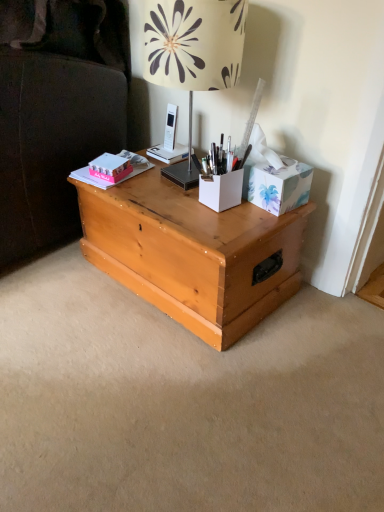
Question: From a real-world perspective, does beige floral lampshade at upper center stand above white matte pen holder at center, the first cardboard box in the left-to-right sequence?

Choices:
 (A) no
 (B) yes

Answer: (B)

Question: Does beige floral lampshade at upper center have a larger size compared to white matte pen holder at center, the first cardboard box in the left-to-right sequence?

Choices:
 (A) yes
 (B) no

Answer: (A)

Question: Does beige floral lampshade at upper center turn towards white matte pen holder at center, the first cardboard box in the left-to-right sequence?

Choices:
 (A) no
 (B) yes

Answer: (A)

Question: Is beige floral lampshade at upper center turned away from white matte pen holder at center, marked as the 2th cardboard box in a right-to-left arrangement?

Choices:
 (A) yes
 (B) no

Answer: (B)

Question: Is white matte pen holder at center, marked as the 2th cardboard box in a right-to-left arrangement, surrounded by beige floral lampshade at upper center?

Choices:
 (A) no
 (B) yes

Answer: (A)

Question: From a real-world perspective, is beige floral lampshade at upper center physically below white matte pen holder at center, marked as the 2th cardboard box in a right-to-left arrangement?

Choices:
 (A) yes
 (B) no

Answer: (B)

Question: From a real-world perspective, is floral-patterned cardboard tissue box at upper right, the first cardboard box positioned from the right, positioned over pink matte box at upper left based on gravity?

Choices:
 (A) no
 (B) yes

Answer: (B)

Question: Considering the relative sizes of floral-patterned cardboard tissue box at upper right, the first cardboard box positioned from the right, and pink matte box at upper left in the image provided, is floral-patterned cardboard tissue box at upper right, the first cardboard box positioned from the right, taller than pink matte box at upper left?

Choices:
 (A) no
 (B) yes

Answer: (B)

Question: Is floral-patterned cardboard tissue box at upper right, marked as the second cardboard box in a left-to-right arrangement, at the left side of pink matte box at upper left?

Choices:
 (A) no
 (B) yes

Answer: (A)

Question: Is floral-patterned cardboard tissue box at upper right, the first cardboard box positioned from the right, touching pink matte box at upper left?

Choices:
 (A) yes
 (B) no

Answer: (B)

Question: From a real-world perspective, is floral-patterned cardboard tissue box at upper right, marked as the second cardboard box in a left-to-right arrangement, below pink matte box at upper left?

Choices:
 (A) yes
 (B) no

Answer: (B)

Question: Is floral-patterned cardboard tissue box at upper right, marked as the second cardboard box in a left-to-right arrangement, positioned in front of pink matte box at upper left?

Choices:
 (A) no
 (B) yes

Answer: (B)

Question: From the image's perspective, is pink matte book at upper left located beneath pink matte box at upper left?

Choices:
 (A) no
 (B) yes

Answer: (A)